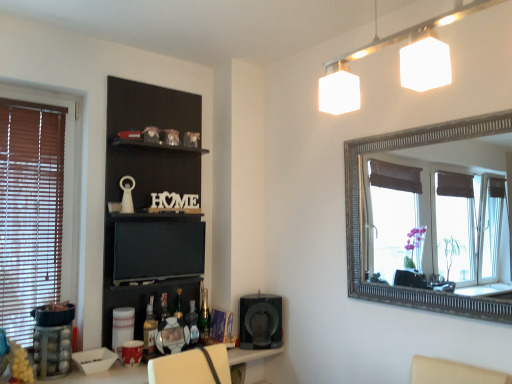
Question: Can you confirm if black matte shelf at upper center is bigger than white glossy table at lower center?

Choices:
 (A) no
 (B) yes

Answer: (A)

Question: From a real-world perspective, is black matte shelf at upper center located higher than white glossy table at lower center?

Choices:
 (A) no
 (B) yes

Answer: (B)

Question: Does black matte shelf at upper center lie in front of white glossy table at lower center?

Choices:
 (A) yes
 (B) no

Answer: (B)

Question: Are black matte shelf at upper center and white glossy table at lower center beside each other?

Choices:
 (A) no
 (B) yes

Answer: (A)

Question: Considering the relative sizes of black matte shelf at upper center and white glossy table at lower center in the image provided, is black matte shelf at upper center shorter than white glossy table at lower center?

Choices:
 (A) no
 (B) yes

Answer: (A)

Question: Considering their positions, is green glass bottle at lower center, which is the 1th bottle from back to front, located in front of or behind translucent glass bottle at lower center, positioned as the 1th bottle in left-to-right order?

Choices:
 (A) front
 (B) behind

Answer: (B)

Question: From a real-world perspective, is green glass bottle at lower center, which is the third bottle from front to back, physically located above or below translucent glass bottle at lower center, the first bottle when ordered from front to back?

Choices:
 (A) above
 (B) below

Answer: (A)

Question: Choose the correct answer: Is green glass bottle at lower center, which is the 1th bottle from back to front, inside translucent glass bottle at lower center, the third bottle positioned from the right, or outside it?

Choices:
 (A) outside
 (B) inside

Answer: (A)

Question: Is point (204, 297) closer or farther from the camera than point (152, 334)?

Choices:
 (A) farther
 (B) closer

Answer: (A)

Question: In terms of height, does translucent glass bottle at lower center, positioned as the 1th bottle in left-to-right order, look taller or shorter compared to matte black tv at center?

Choices:
 (A) tall
 (B) short

Answer: (B)

Question: Based on their positions, is translucent glass bottle at lower center, acting as the 3th bottle starting from the back, located to the left or right of matte black tv at center?

Choices:
 (A) left
 (B) right

Answer: (A)

Question: From the image's perspective, is translucent glass bottle at lower center, the third bottle positioned from the right, above or below matte black tv at center?

Choices:
 (A) above
 (B) below

Answer: (B)

Question: Considering the positions of translucent glass bottle at lower center, the first bottle when ordered from front to back, and matte black tv at center in the image, is translucent glass bottle at lower center, the first bottle when ordered from front to back, bigger or smaller than matte black tv at center?

Choices:
 (A) big
 (B) small

Answer: (B)

Question: In terms of height, does metallic silver picture frame at center look taller or shorter compared to translucent glass bottle at lower center, positioned as the 1th bottle in left-to-right order?

Choices:
 (A) tall
 (B) short

Answer: (B)

Question: Looking at the image, does metallic silver picture frame at center seem bigger or smaller compared to translucent glass bottle at lower center, positioned as the 1th bottle in left-to-right order?

Choices:
 (A) small
 (B) big

Answer: (B)